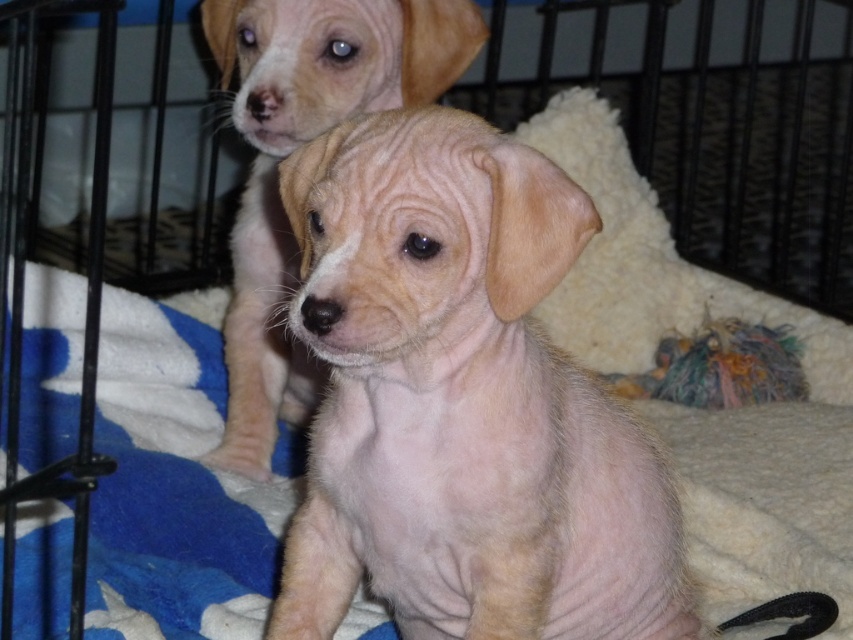
You are a dog trainer who needs to place a new toy between the light beige fur at center and the white fleece blanket at center. Can you fit a toy that is 14 inches long in that space?

The distance between the light beige fur at center and the white fleece blanket at center is 14.22 inches. Since the toy is 14 inches long, it can fit in the space between them.

In the scene shown: You are a veterinarian examining two puppies in a cage. You notice the light beige fur at center and the light brown fur at center. Which puppy is sitting on top of the other?

The light brown fur at center is sitting on top of the light beige fur at center because the light beige fur at center is positioned under light brown fur at center according to the description.

Looking at this image, you are a dog breeder who wants to ensure both puppies have enough space to move comfortably inside the cage. Given the cage has limited space, can you determine if the light beige fur at center and the white fleece blanket at center are positioned in a way that allows enough room for the puppies?

The light beige fur at center has a lesser width compared to the white fleece blanket at center, meaning the blanket takes up more space. Since the blanket is wider, it might be occupying more of the cage floor, leaving less room for the puppies to move. To ensure enough space, consider rearranging the blanket or reducing its size.